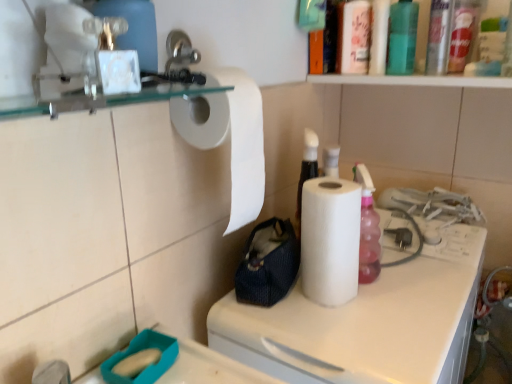
Image resolution: width=512 pixels, height=384 pixels. In order to click on free spot in front of navy blue fabric pouch at center in this screenshot , I will do `click(296, 326)`.